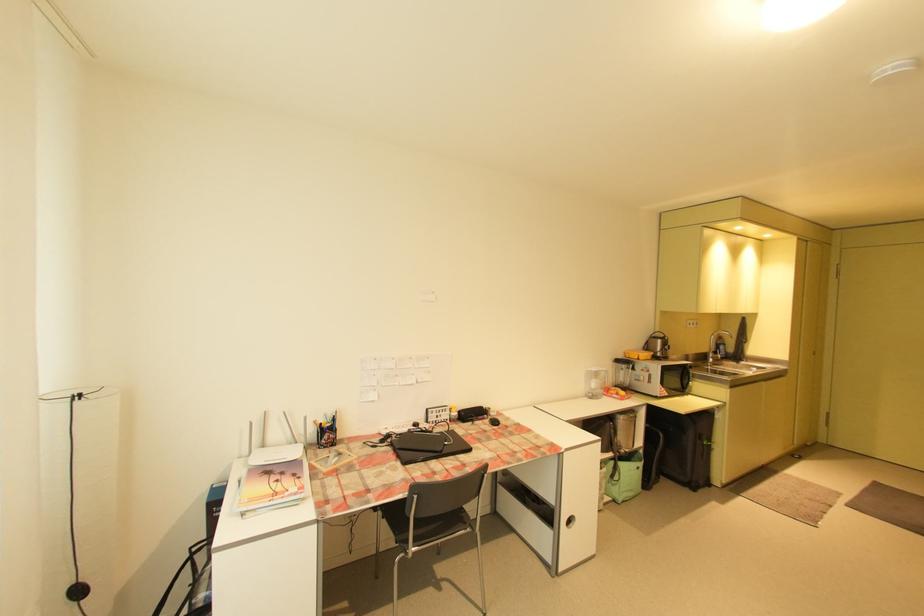
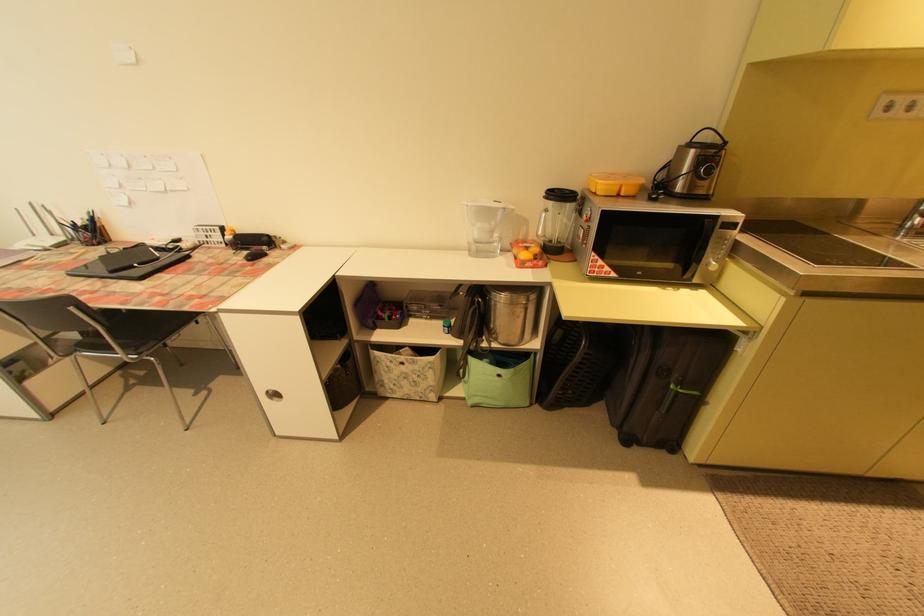
Find the pixel in the second image that matches the point at 633,394 in the first image.

(541, 259)